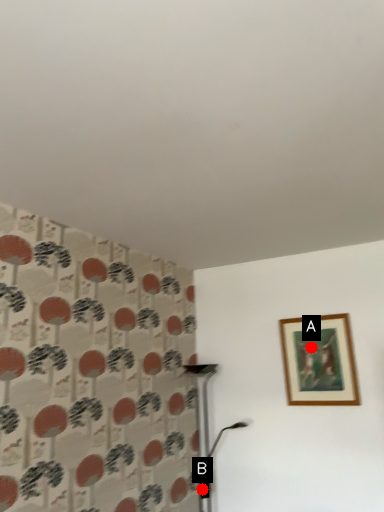
Question: Two points are circled on the image, labeled by A and B beside each circle. Which of the following is the farthest from the observer?

Choices:
 (A) A is further
 (B) B is further

Answer: (B)